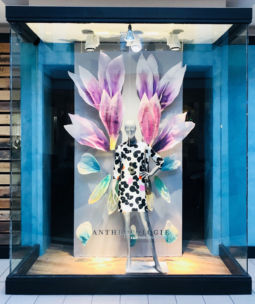
Locate an element on the screen. mannequin head is located at coordinates (131, 132).